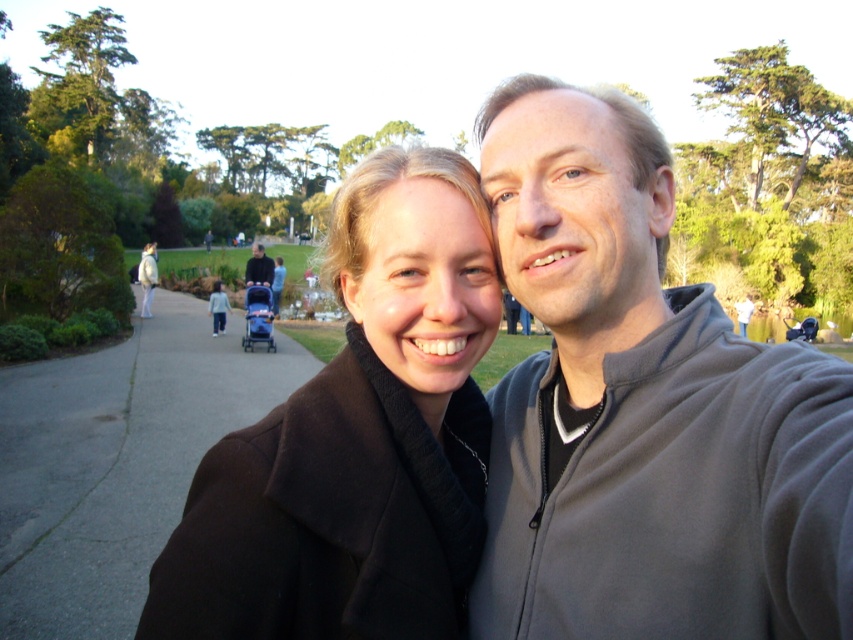
Does black wool coat at center have a lesser height compared to gray fleece sweatshirt at upper right?

Incorrect, black wool coat at center's height does not fall short of gray fleece sweatshirt at upper right's.

Locate an element on the screen. black wool coat at center is located at coordinates (357, 438).

Is dark brown coat at center wider than dark blue stroller at center?

In fact, dark brown coat at center might be narrower than dark blue stroller at center.

Consider the image. Can you confirm if dark brown coat at center is positioned to the right of dark blue stroller at center?

Indeed, dark brown coat at center is positioned on the right side of dark blue stroller at center.

In the scene shown: Who is more distant from viewer, (723, 360) or (252, 248)?

The point (252, 248) is behind.

Where is `dark brown coat at center`? This screenshot has width=853, height=640. dark brown coat at center is located at coordinates (643, 410).

Is dark brown coat at center to the right of gray fleece sweatshirt at upper right from the viewer's perspective?

Incorrect, dark brown coat at center is not on the right side of gray fleece sweatshirt at upper right.

Does point (672, 528) come behind point (569, 552)?

That is False.

Identify the location of dark brown coat at center. The width and height of the screenshot is (853, 640). (643, 410).